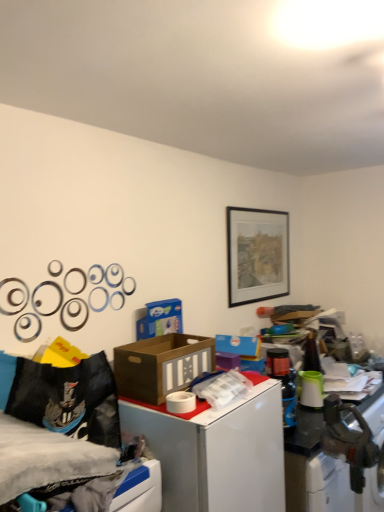
I want to click on free space above black matte picture frame at upper center (from a real-world perspective), so click(x=257, y=207).